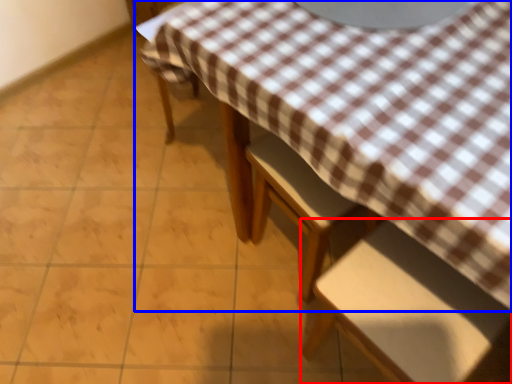
Question: Which of the following is the farthest to the observer, chair (highlighted by a red box) or table (highlighted by a blue box)?

Choices:
 (A) chair
 (B) table

Answer: (B)